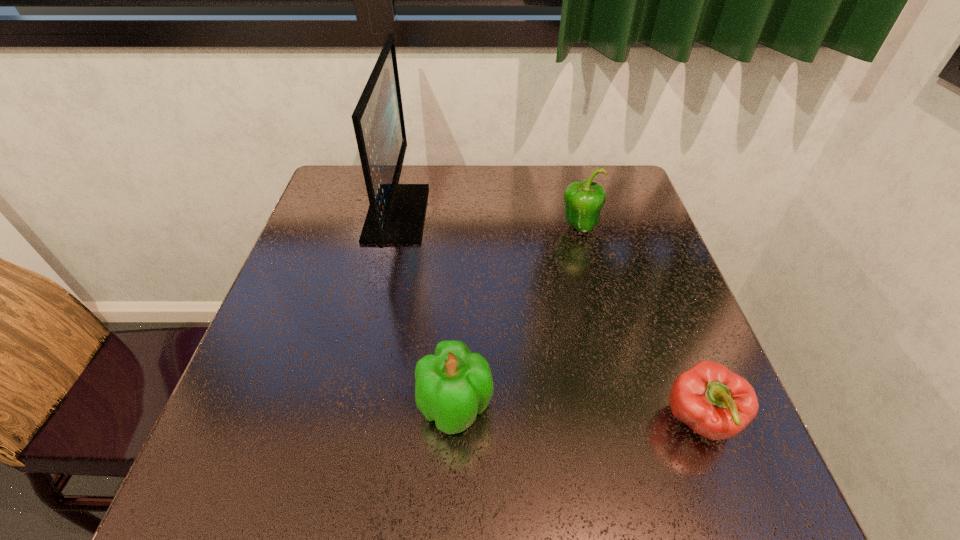
This screenshot has width=960, height=540. What are the coordinates of `free space at the far right corner of the desktop` in the screenshot? It's located at coord(574,164).

Locate an element on the screen. vacant space at the near right corner of the desktop is located at coordinates pyautogui.click(x=754, y=483).

Locate an element on the screen. free space between the monitor and the shortest bell pepper is located at coordinates (548, 317).

The height and width of the screenshot is (540, 960). I want to click on vacant area that lies between the rightmost bell pepper and the leftmost bell pepper, so click(x=578, y=414).

Image resolution: width=960 pixels, height=540 pixels. Find the location of `unoccupied area between the shortest bell pepper and the second bell pepper from left to right`. unoccupied area between the shortest bell pepper and the second bell pepper from left to right is located at coordinates (639, 324).

Identify the location of vacant space in between the leftmost object and the leftmost bell pepper. Image resolution: width=960 pixels, height=540 pixels. click(426, 310).

Identify the location of free space that is in between the second object from left to right and the farthest bell pepper. (517, 318).

At what (x,y) coordinates should I click in order to perform the action: click on vacant area between the leftmost bell pepper and the farthest bell pepper. Please return your answer as a coordinate pair (x, y). The width and height of the screenshot is (960, 540). Looking at the image, I should click on (517, 318).

The image size is (960, 540). Find the location of `vacant region between the rightmost bell pepper and the tallest object`. vacant region between the rightmost bell pepper and the tallest object is located at coordinates (548, 317).

Find the location of a particular element. The height and width of the screenshot is (540, 960). vacant space that is in between the leftmost bell pepper and the shortest bell pepper is located at coordinates (578, 414).